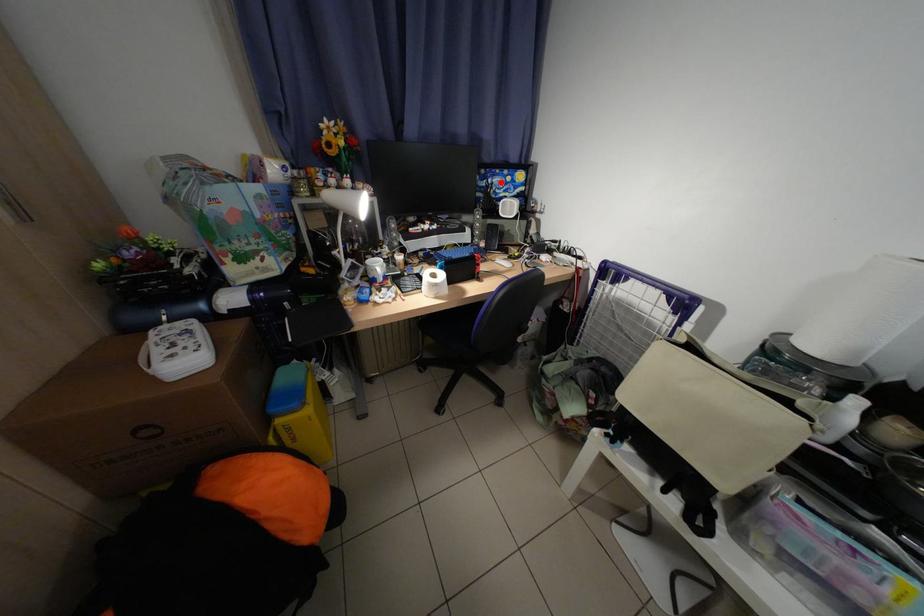
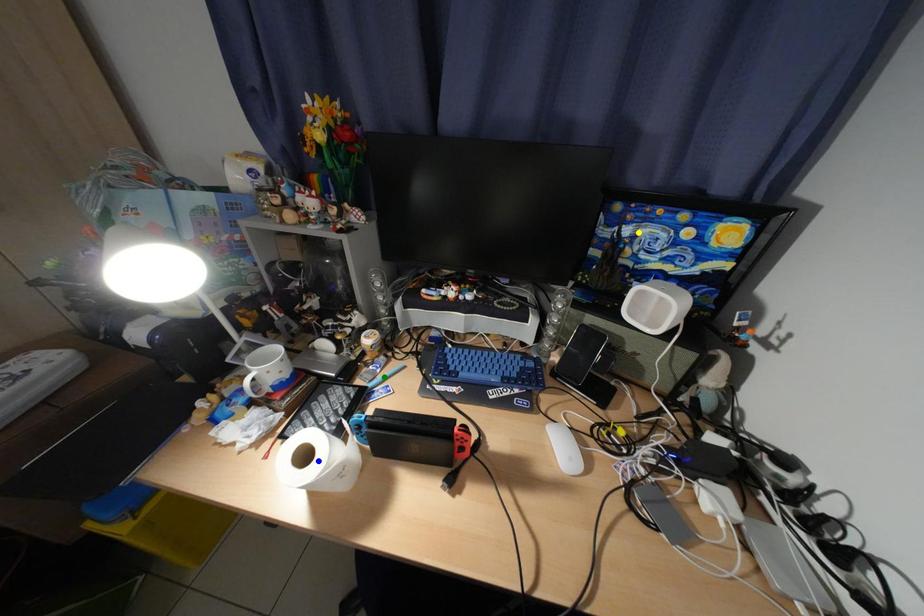
Question: I am providing you with two images of the same scene from different viewpoints. A red point is marked on the first image. You are given multiple points on the second image. Which point in image 2 represents the same 3d spot as the red point in image 1?

Choices:
 (A) blue point
 (B) green point
 (C) yellow point

Answer: (C)